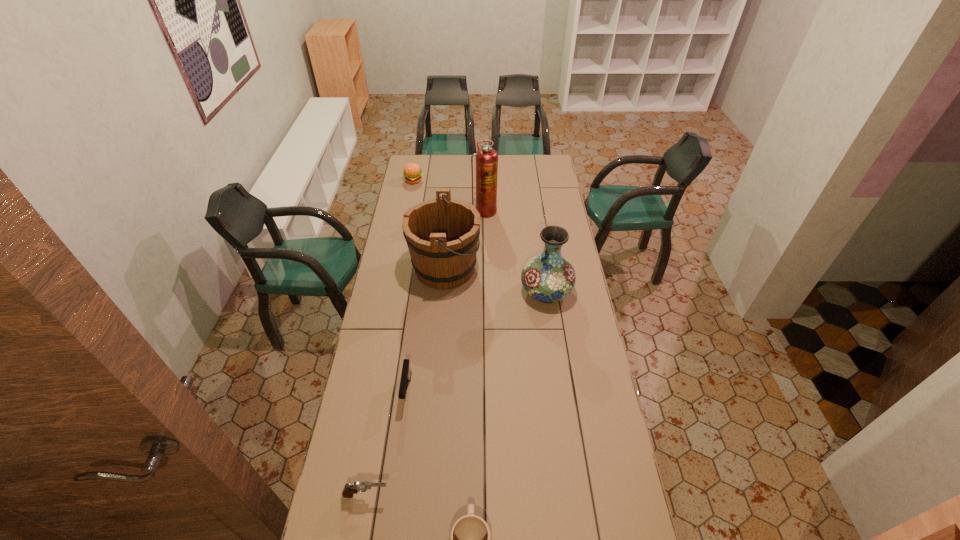
Find the location of a particular element. The height and width of the screenshot is (540, 960). the second farthest object is located at coordinates click(486, 158).

Image resolution: width=960 pixels, height=540 pixels. Find the location of `the tallest object`. the tallest object is located at coordinates (486, 158).

The height and width of the screenshot is (540, 960). Identify the location of wine bucket. (442, 234).

Where is `vase`? vase is located at coordinates (549, 277).

The image size is (960, 540). In order to click on hamburger in this screenshot , I will do `click(412, 172)`.

The width and height of the screenshot is (960, 540). Find the location of `the farther pistol`. the farther pistol is located at coordinates (406, 373).

At what (x,y) coordinates should I click in order to perform the action: click on the second nearest object. Please return your answer as a coordinate pair (x, y). Looking at the image, I should click on (349, 490).

Image resolution: width=960 pixels, height=540 pixels. I want to click on vacant space situated 0.360m on the side of the second farthest object with the label, so click(x=485, y=265).

Where is `vacant space located on the side of the wine bucket with the handle for carrying`? This screenshot has height=540, width=960. vacant space located on the side of the wine bucket with the handle for carrying is located at coordinates (535, 268).

Image resolution: width=960 pixels, height=540 pixels. I want to click on free location located on the front of the vase, so click(x=559, y=376).